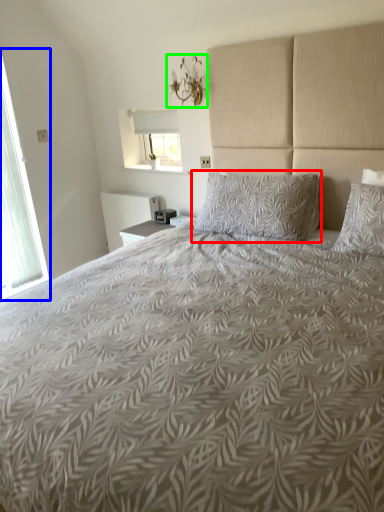
Question: Estimate the real-world distances between objects in this image. Which object is closer to pillow (highlighted by a red box), window (highlighted by a blue box) or light fixture (highlighted by a green box)?

Choices:
 (A) window
 (B) light fixture

Answer: (B)